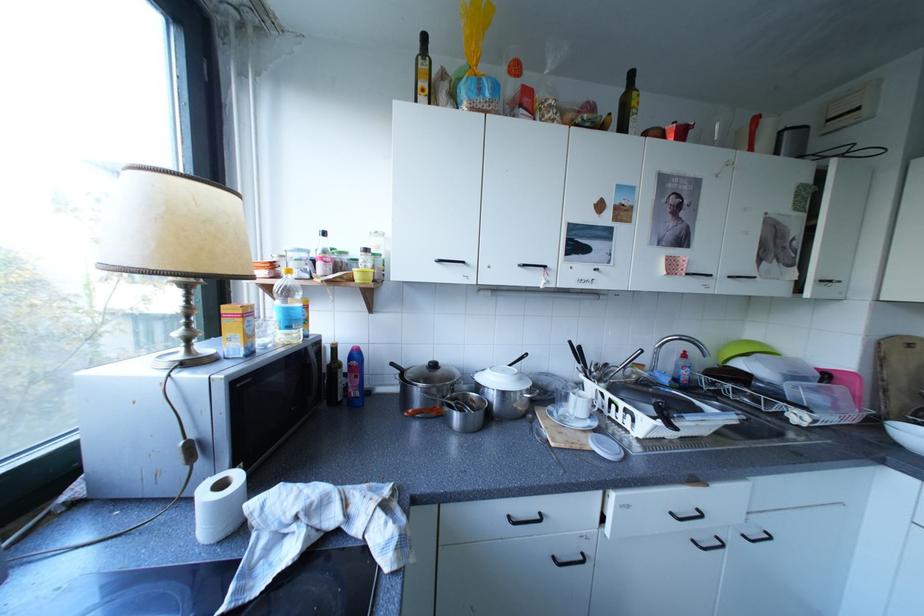
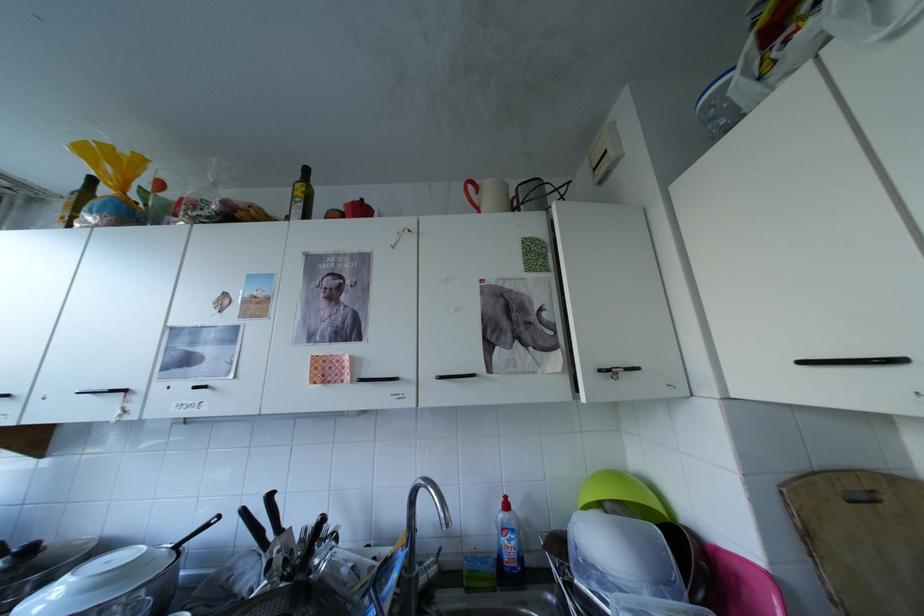
Question: In a continuous first-person perspective shot, in which direction is the camera moving?

Choices:
 (A) Left
 (B) Right
 (C) Forward
 (D) Backward

Answer: (B)